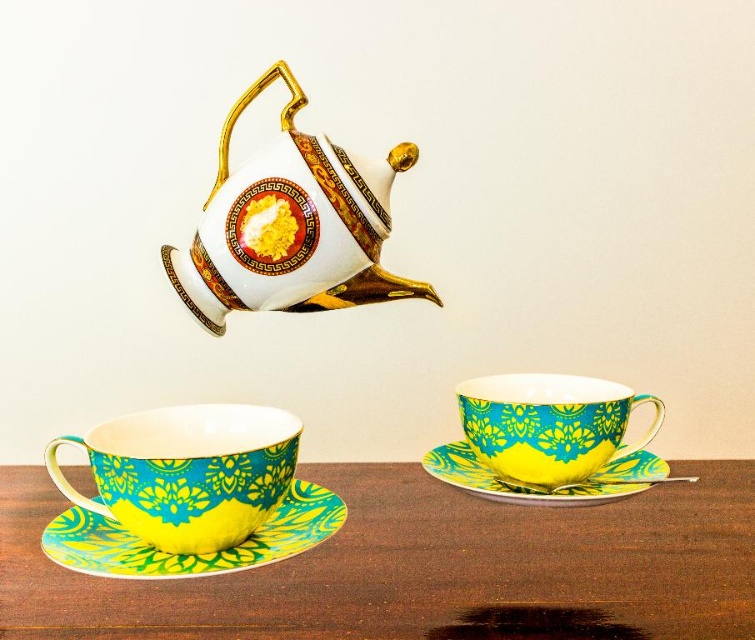
Who is shorter, white porcelain teapot at upper center or yellow glossy saucer at lower left?

yellow glossy saucer at lower left is shorter.

The width and height of the screenshot is (755, 640). In order to click on white porcelain teapot at upper center in this screenshot , I will do `click(291, 225)`.

Does white porcelain teapot at upper center have a greater height compared to turquoise glossy teacup at lower left?

Correct, white porcelain teapot at upper center is much taller as turquoise glossy teacup at lower left.

Does point (165, 246) come in front of point (113, 513)?

No.

This screenshot has width=755, height=640. In order to click on white porcelain teapot at upper center in this screenshot , I will do `click(291, 225)`.

Which is below, matte ceramic table at lower center or turquoise glossy teacup at lower left?

matte ceramic table at lower center is lower down.

Can you confirm if matte ceramic table at lower center is shorter than turquoise glossy teacup at lower left?

Yes.

Is point (479, 545) closer to viewer compared to point (106, 512)?

No, it is not.

This screenshot has width=755, height=640. I want to click on matte ceramic table at lower center, so click(x=424, y=566).